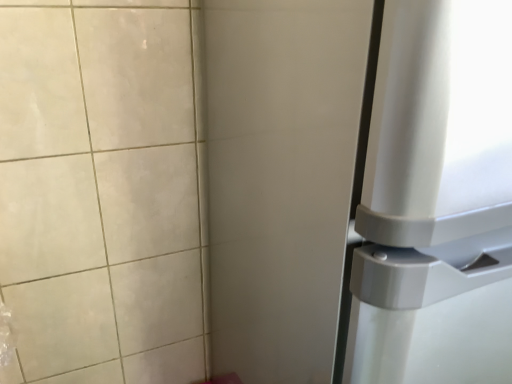
Identify the location of white glossy refrigerator at right. This screenshot has height=384, width=512. (360, 190).

What do you see at coordinates (360, 190) in the screenshot? I see `white glossy refrigerator at right` at bounding box center [360, 190].

Identify the location of white glossy refrigerator at right. The height and width of the screenshot is (384, 512). (360, 190).